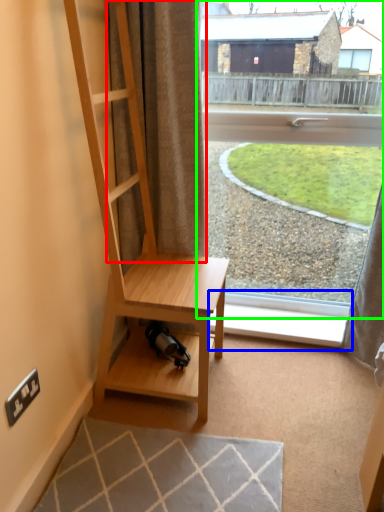
Question: Considering the real-world distances, which object is closest to curtain (highlighted by a red box)? window sill (highlighted by a blue box) or window (highlighted by a green box).

Choices:
 (A) window sill
 (B) window

Answer: (A)